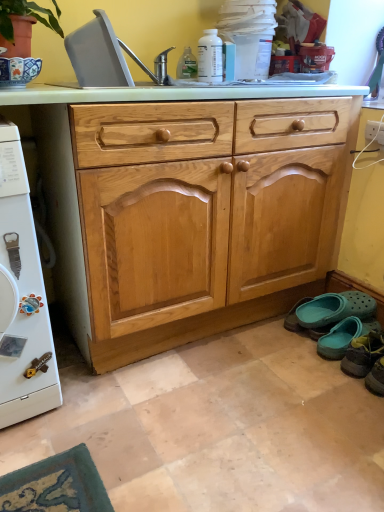
Question: In terms of size, does teal rubber clogs at lower right, which is the 2th footwear from front to back, appear bigger or smaller than gray plastic sink at upper left?

Choices:
 (A) big
 (B) small

Answer: (B)

Question: From a real-world perspective, relative to gray plastic sink at upper left, is teal rubber clogs at lower right, the first footwear from the back, vertically above or below?

Choices:
 (A) above
 (B) below

Answer: (B)

Question: Based on their relative distances, which object is farther from the gray plastic sink at upper left?

Choices:
 (A) light wood drawer at center
 (B) teal rubber clogs at lower right, which is the 2th footwear from front to back
 (C) teal fabric slipper at lower right, positioned as the 2th footwear in back-to-front order

Answer: (C)

Question: Which of these objects is positioned closest to the teal fabric slipper at lower right, positioned as the 2th footwear in back-to-front order?

Choices:
 (A) gray plastic sink at upper left
 (B) light wood drawer at center
 (C) teal rubber clogs at lower right, the first footwear from the back

Answer: (C)